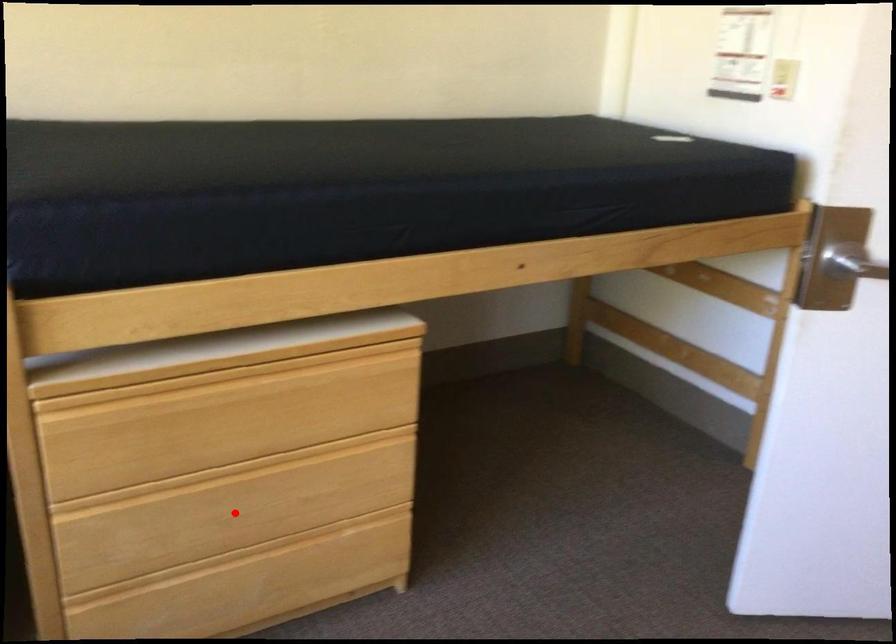
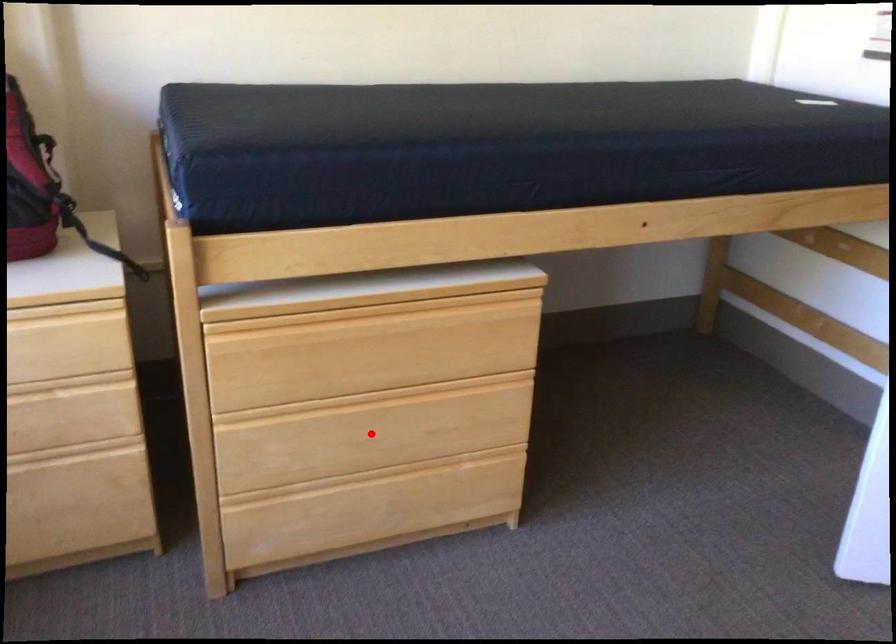
I am providing you with two images of the same scene from different viewpoints. A red point is marked on the first image and another point is marked on the second image. Is the marked point in image1 the same physical position as the marked point in image2?

Yes